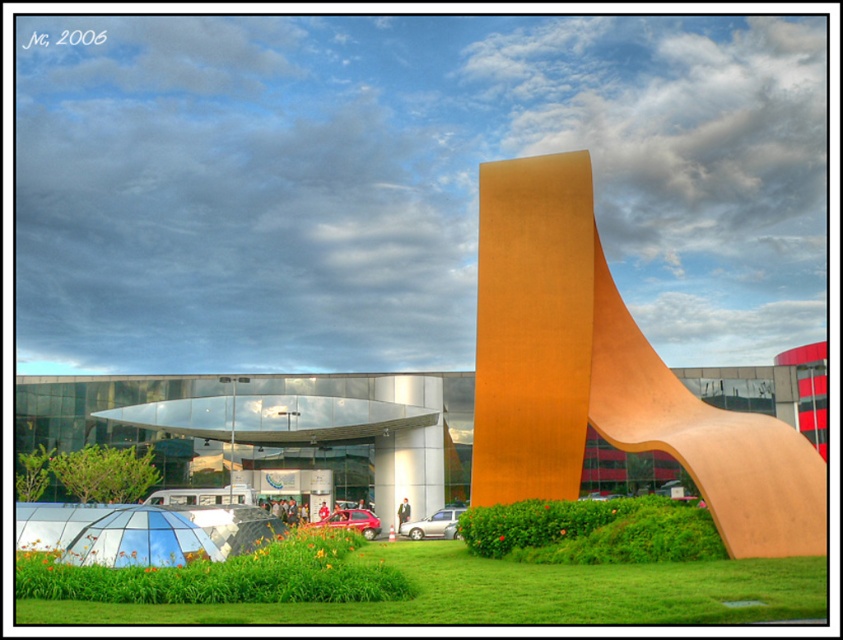
This screenshot has width=843, height=640. I want to click on matte orange sculpture at center, so click(x=605, y=376).

Where is `matte orange sculpture at center`? matte orange sculpture at center is located at coordinates (605, 376).

Describe the element at coordinates (441, 592) in the screenshot. I see `green grass at lower center` at that location.

Is point (808, 568) positioned in front of point (591, 536)?

Yes, point (808, 568) is in front of point (591, 536).

Where is `green grass at lower center`? The image size is (843, 640). green grass at lower center is located at coordinates (441, 592).

Which is more to the right, matte orange sculpture at center or green leafy bush at center?

From the viewer's perspective, matte orange sculpture at center appears more on the right side.

Who is more forward, (803, 531) or (471, 541)?

Positioned in front is point (803, 531).

Where is `matte orange sculpture at center`? This screenshot has width=843, height=640. matte orange sculpture at center is located at coordinates (605, 376).